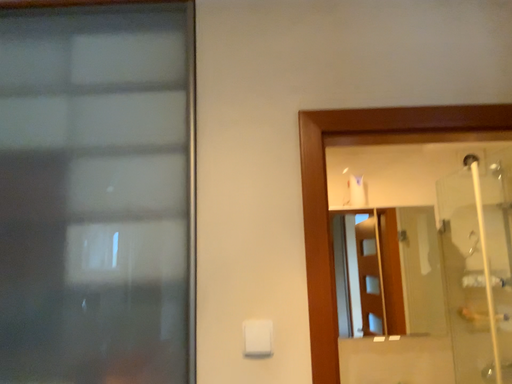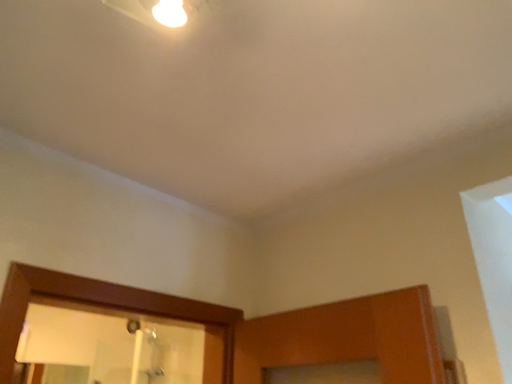
Question: How did the camera likely rotate when shooting the video?

Choices:
 (A) rotated downward
 (B) rotated upward

Answer: (B)